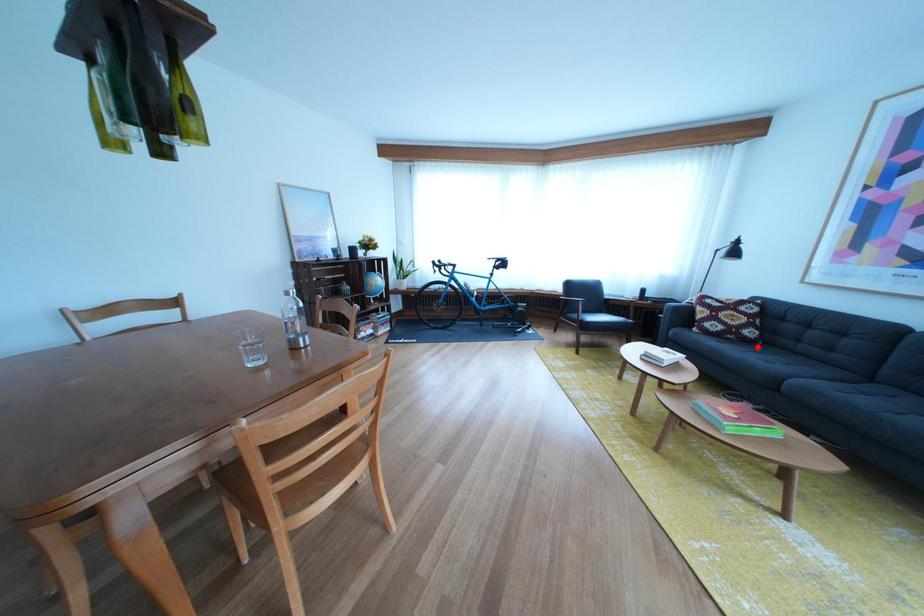
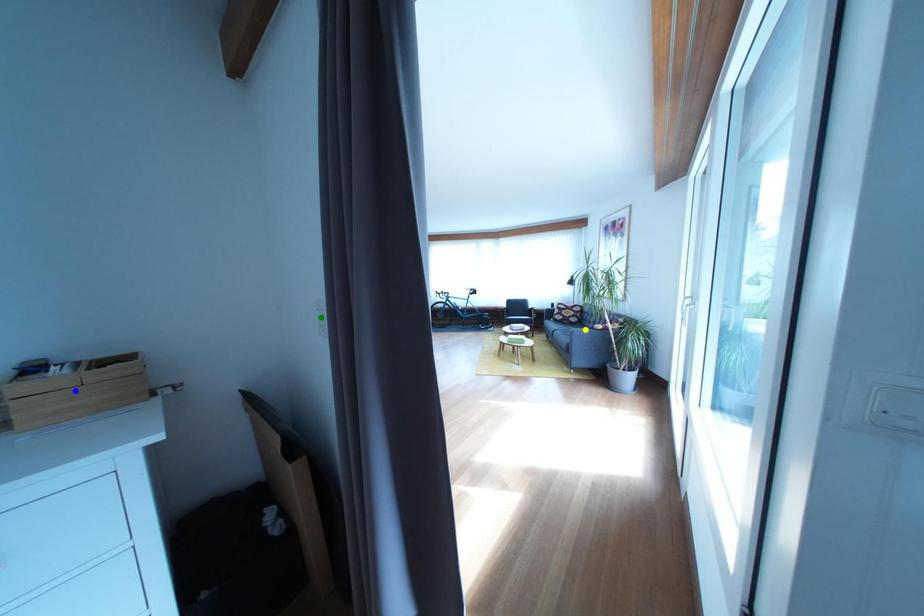
Question: I am providing you with two images of the same scene from different viewpoints. A red point is marked on the first image. You are given multiple points on the second image. Which point in image 2 represents the same 3d spot as the red point in image 1?

Choices:
 (A) yellow point
 (B) blue point
 (C) green point

Answer: (A)